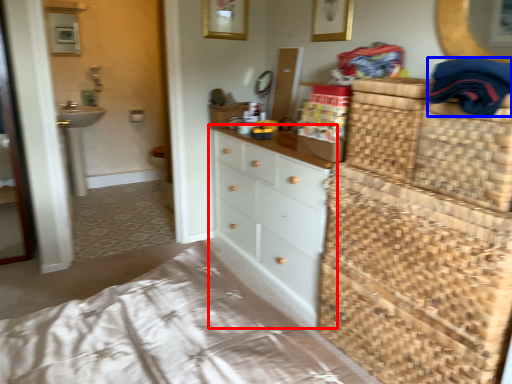
Question: Among these objects, which one is farthest to the camera, chest of drawers (highlighted by a red box) or clothing (highlighted by a blue box)?

Choices:
 (A) chest of drawers
 (B) clothing

Answer: (A)